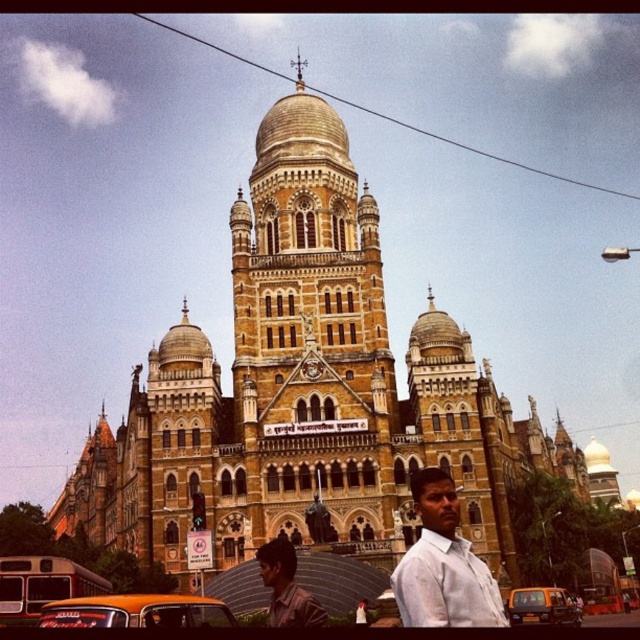
You are a tourist standing on the street in front of the grand building. You see the white cotton shirt at center and the yellow matte taxi at lower left. Which object is located to the right of the other?

The white cotton shirt at center is positioned on the right side of yellow matte taxi at lower left.